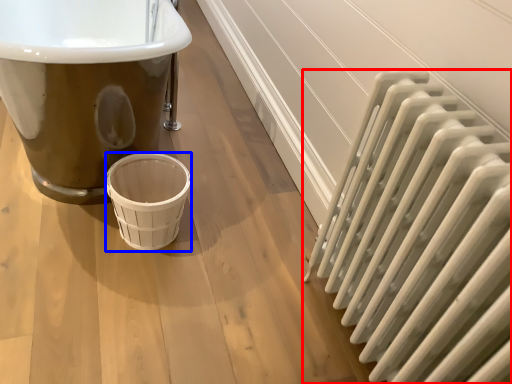
Question: Which of the following is the closest to the observer, radiator (highlighted by a red box) or basket (highlighted by a blue box)?

Choices:
 (A) radiator
 (B) basket

Answer: (A)